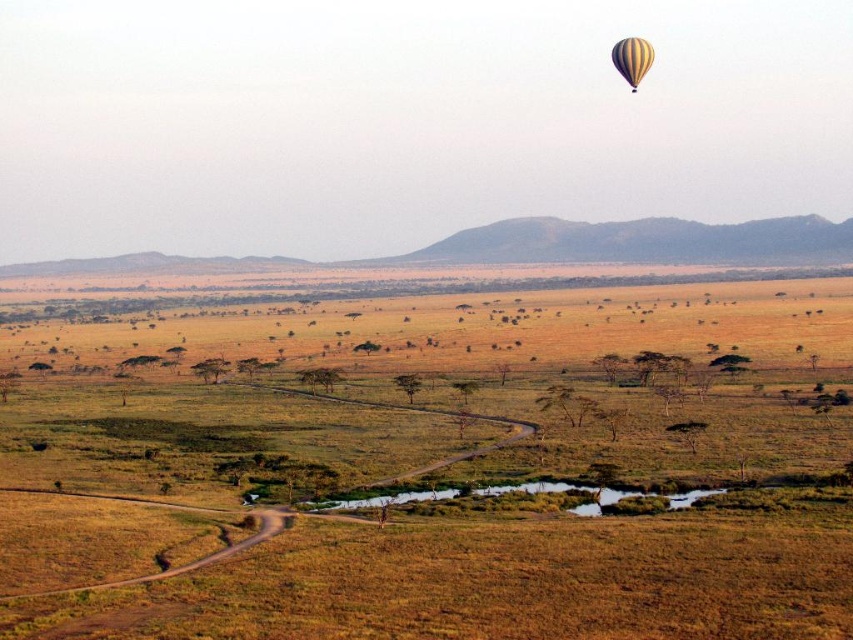
You are a hot air balloonist preparing to land your yellow striped balloon at upper right in the savanna. The brown grassland at center is your intended landing spot. Based on the scene description, will the balloon be visible above the grassland after landing?

The brown grassland at center has a greater height compared to the yellow striped balloon at upper right. Therefore, after landing, the balloon will be obscured by the grassland and not visible above it.